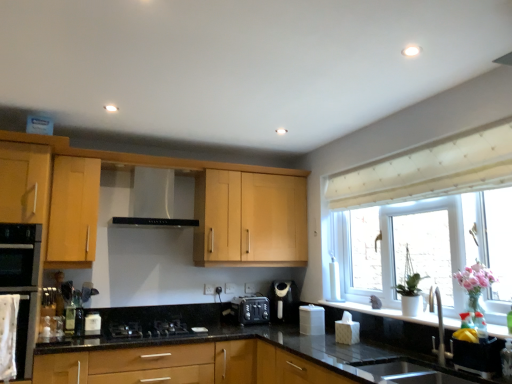
Question: Can you confirm if translucent glass bottle at lower left is positioned to the left of black plastic toaster at center?

Choices:
 (A) no
 (B) yes

Answer: (B)

Question: From a real-world perspective, does translucent glass bottle at lower left stand above black plastic toaster at center?

Choices:
 (A) no
 (B) yes

Answer: (B)

Question: Is translucent glass bottle at lower left beside black plastic toaster at center?

Choices:
 (A) no
 (B) yes

Answer: (A)

Question: Can you confirm if translucent glass bottle at lower left is positioned to the right of black plastic toaster at center?

Choices:
 (A) no
 (B) yes

Answer: (A)

Question: Is translucent glass bottle at lower left taller than black plastic toaster at center?

Choices:
 (A) no
 (B) yes

Answer: (B)

Question: In the image, is black granite sink at lower center, positioned as the 1th sink in bottom-to-top order, positioned in front of or behind black granite countertop at center?

Choices:
 (A) front
 (B) behind

Answer: (B)

Question: Choose the correct answer: Is black granite sink at lower center, the second sink from the top, inside black granite countertop at center or outside it?

Choices:
 (A) outside
 (B) inside

Answer: (B)

Question: Is point (455, 332) closer or farther from the camera than point (329, 359)?

Choices:
 (A) farther
 (B) closer

Answer: (B)

Question: Is black granite sink at lower center, positioned as the 1th sink in bottom-to-top order, taller or shorter than black granite countertop at center?

Choices:
 (A) tall
 (B) short

Answer: (B)

Question: From the image's perspective, is black granite sink at lower center, positioned as the 1th sink in bottom-to-top order, positioned above or below white matte window sill at lower right?

Choices:
 (A) above
 (B) below

Answer: (B)

Question: Relative to white matte window sill at lower right, is black granite sink at lower center, positioned as the 1th sink in bottom-to-top order, in front or behind?

Choices:
 (A) behind
 (B) front

Answer: (B)

Question: From a real-world perspective, is black granite sink at lower center, positioned as the 1th sink in bottom-to-top order, above or below white matte window sill at lower right?

Choices:
 (A) below
 (B) above

Answer: (A)

Question: Is black granite sink at lower center, the second sink from the top, to the left or to the right of white matte window sill at lower right in the image?

Choices:
 (A) left
 (B) right

Answer: (A)

Question: From a real-world perspective, relative to translucent glass bottle at lower left, is white plastic window at center vertically above or below?

Choices:
 (A) below
 (B) above

Answer: (B)

Question: Considering the positions of white plastic window at center and translucent glass bottle at lower left in the image, is white plastic window at center taller or shorter than translucent glass bottle at lower left?

Choices:
 (A) tall
 (B) short

Answer: (A)